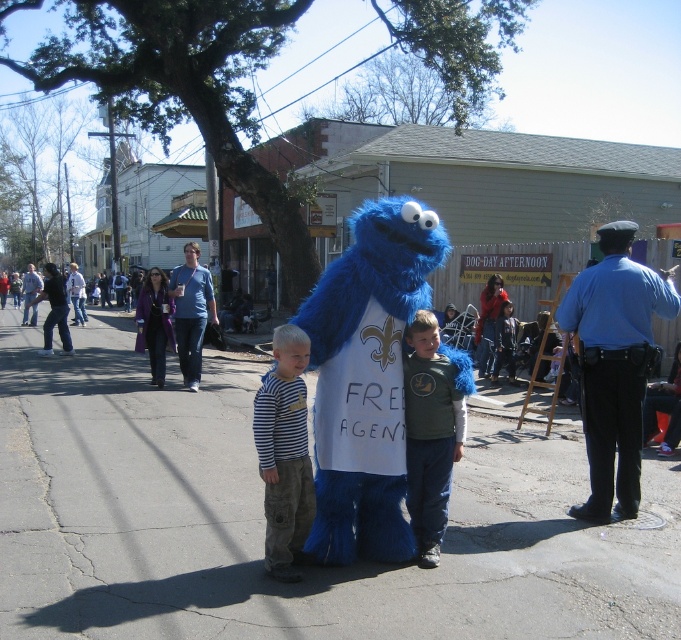
Based on the photo, between fuzzy blue mascot at center and denim jacket at center, which one appears on the right side from the viewer's perspective?

→ Positioned to the right is fuzzy blue mascot at center.

Is fuzzy blue mascot at center to the left of denim jacket at center from the viewer's perspective?

Incorrect, fuzzy blue mascot at center is not on the left side of denim jacket at center.

Between point (364, 285) and point (78, 310), which one is positioned behind?

Positioned behind is point (78, 310).

Find the location of `fuzzy blue mascot at center`. fuzzy blue mascot at center is located at coordinates (366, 380).

Is green cotton shirt at center above blue plush costume at center?

No.

Does green cotton shirt at center have a smaller size compared to blue plush costume at center?

Indeed, green cotton shirt at center has a smaller size compared to blue plush costume at center.

What do you see at coordinates (430, 433) in the screenshot?
I see `green cotton shirt at center` at bounding box center [430, 433].

The width and height of the screenshot is (681, 640). I want to click on green cotton shirt at center, so click(x=430, y=433).

Between blue fuzzy costume at center and denim jacket at center, which one is positioned higher?

denim jacket at center is above.

Is point (205, 312) positioned behind point (69, 289)?

No, (205, 312) is closer to viewer.

Find the location of a particular element. blue fuzzy costume at center is located at coordinates (191, 310).